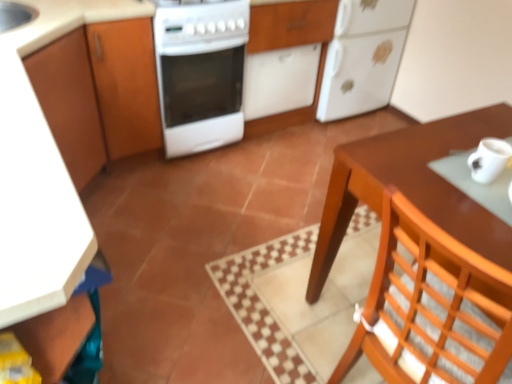
Question: Considering the positions of point (476, 175) and point (304, 9), is point (476, 175) closer or farther from the camera than point (304, 9)?

Choices:
 (A) closer
 (B) farther

Answer: (A)

Question: From the image's perspective, is white matte mug at right above or below white matte cabinet at center, arranged as the first cabinetry when viewed from the right?

Choices:
 (A) above
 (B) below

Answer: (B)

Question: Estimate the real-world distances between objects in this image. Which object is farther from the brown wooden table at right?

Choices:
 (A) wooden cabinet at left, the second cabinetry in the right-to-left sequence
 (B) white matte refrigerator at upper right
 (C) wooden chair at lower right
 (D) white glossy stove at center
 (E) white matte cabinet at center, the 2th cabinetry positioned from the left

Answer: (B)

Question: Which object is positioned farthest from the brown wooden table at right?

Choices:
 (A) white matte refrigerator at upper right
 (B) white glossy stove at center
 (C) wooden cabinet at left, the second cabinetry in the right-to-left sequence
 (D) white matte mug at right
 (E) white matte cabinet at center, the 2th cabinetry positioned from the left

Answer: (A)